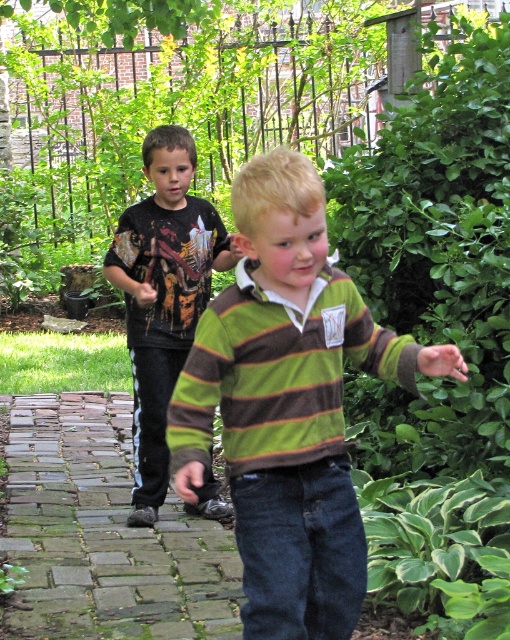
Does brick paved path at center appear on the left side of matte black t-shirt at left?

Yes, brick paved path at center is to the left of matte black t-shirt at left.

Is brick paved path at center taller than matte black t-shirt at left?

In fact, brick paved path at center may be shorter than matte black t-shirt at left.

Between point (228, 589) and point (187, 209), which one is positioned in front?

Point (228, 589)

Locate an element on the screen. The height and width of the screenshot is (640, 510). brick paved path at center is located at coordinates (104, 532).

Does green striped sweater at center appear under brick paved path at center?

Incorrect, green striped sweater at center is not positioned below brick paved path at center.

Which is more to the right, green striped sweater at center or brick paved path at center?

From the viewer's perspective, green striped sweater at center appears more on the right side.

Identify the location of green striped sweater at center. (288, 404).

Can you confirm if green striped sweater at center is taller than matte black t-shirt at left?

In fact, green striped sweater at center may be shorter than matte black t-shirt at left.

Where is `green striped sweater at center`? Image resolution: width=510 pixels, height=640 pixels. green striped sweater at center is located at coordinates (288, 404).